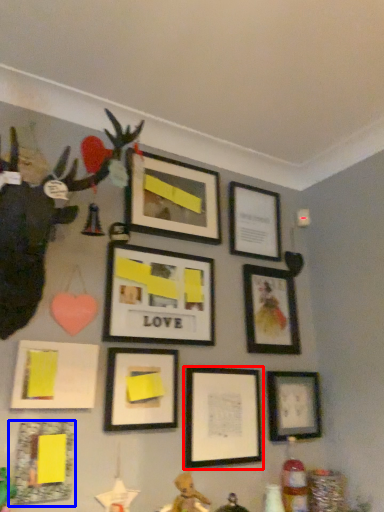
Question: Which point is further to the camera, picture frame (highlighted by a red box) or picture frame (highlighted by a blue box)?

Choices:
 (A) picture frame
 (B) picture frame

Answer: (A)